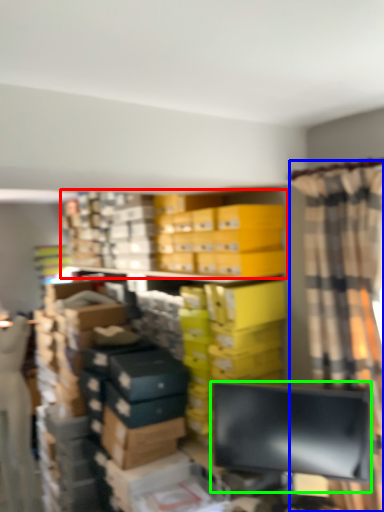
Question: Which is nearer to the bookcase (highlighted by a red box)? curtain (highlighted by a blue box) or computer monitor (highlighted by a green box).

Choices:
 (A) curtain
 (B) computer monitor

Answer: (A)